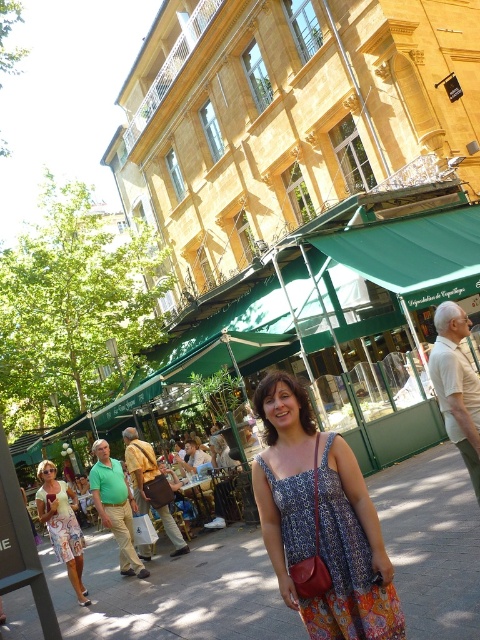
Who is taller, green fabric umbrella at center or printed fabric dress at lower left?

green fabric umbrella at center is taller.

Find the location of a particular element. green fabric umbrella at center is located at coordinates (122, 497).

Who is positioned more to the left, concrete pavement at center or blue printed dress at center?

concrete pavement at center

Is point (214, 579) positioned after point (364, 616)?

Yes.

Identify the location of concrete pavement at center. Image resolution: width=480 pixels, height=640 pixels. (177, 593).

Locate an element on the screen. This screenshot has height=640, width=480. concrete pavement at center is located at coordinates (177, 593).

Does concrete pavement at center come in front of green fabric umbrella at center?

Yes, it is.

Does concrete pavement at center have a greater height compared to green fabric umbrella at center?

Indeed, concrete pavement at center has a greater height compared to green fabric umbrella at center.

Image resolution: width=480 pixels, height=640 pixels. What are the coordinates of `concrete pavement at center` in the screenshot? It's located at (177, 593).